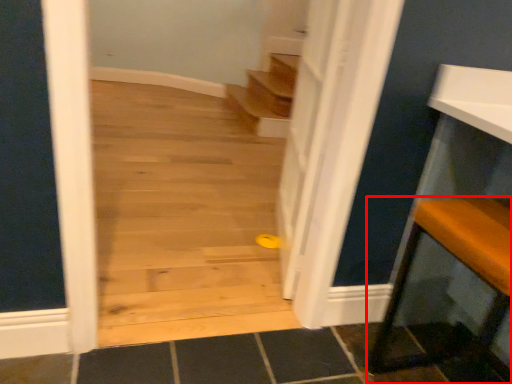
Question: From the image's perspective, what is the correct spatial positioning of furniture (annotated by the red box) in reference to door?

Choices:
 (A) below
 (B) above

Answer: (A)